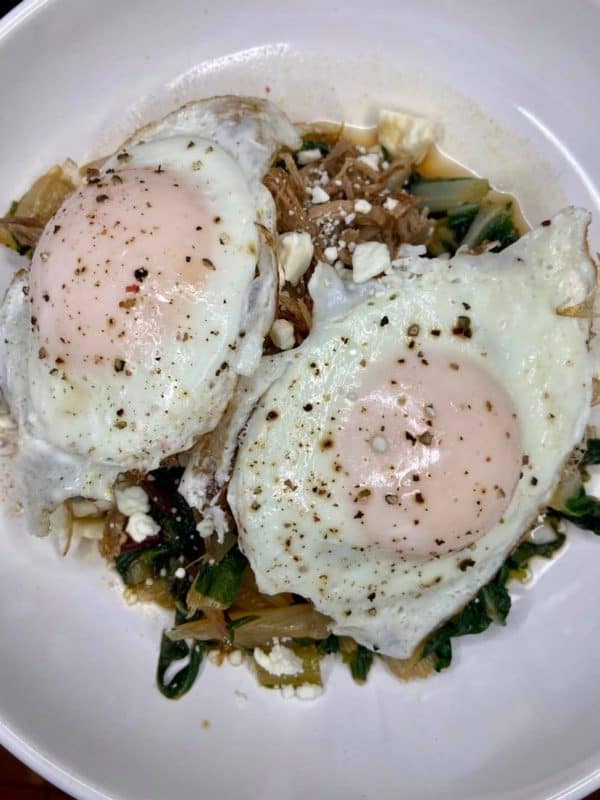
At what (x,y) coordinates should I click in order to perform the action: click on plate. Please return your answer as a coordinate pair (x, y). Image resolution: width=600 pixels, height=800 pixels. Looking at the image, I should click on 495,714.